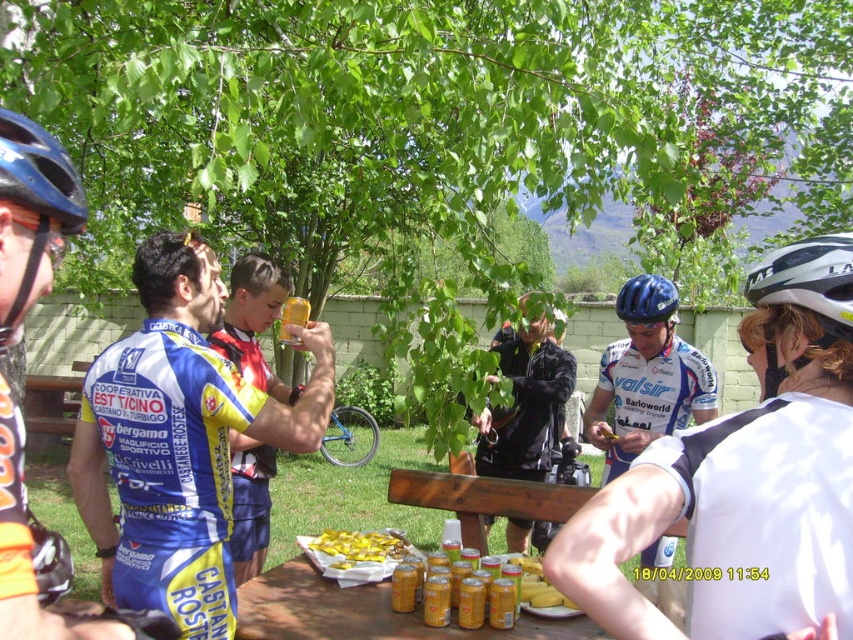
Question: Which object is positioned closest to the blue helmeted cyclist at center?

Choices:
 (A) blue jersey at left
 (B) yellow plastic bag at center
 (C) shiny blue helmet at left

Answer: (B)

Question: Which object is positioned farthest from the yellow fabric jersey at center?

Choices:
 (A) yellow paper plate at center
 (B) shiny blue helmet at left
 (C) white matte bicycle helmet at upper right

Answer: (C)

Question: Which point is farther to the camera?

Choices:
 (A) (294, 337)
 (B) (380, 532)
 (C) (849, 321)
 (D) (148, 355)

Answer: (B)

Question: Does shiny blue helmet at left appear under yellow plastic bag at center?

Choices:
 (A) yes
 (B) no

Answer: (B)

Question: Observing the image, what is the correct spatial positioning of blue jersey at center in reference to blue helmeted cyclist at center?

Choices:
 (A) right
 (B) left

Answer: (B)

Question: Does white jersey at center have a greater width compared to shiny blue helmet at left?

Choices:
 (A) yes
 (B) no

Answer: (A)